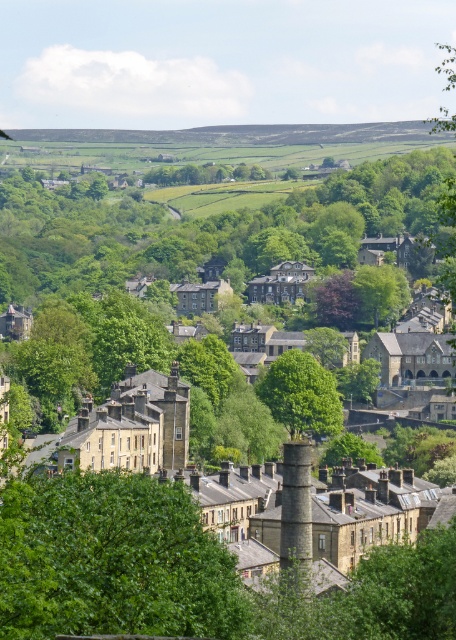
You are a bird flying over the town and want to land on the stone chimney at center. However, there is a green leafy tree at center in the way. Can you land on the chimney without flying through the tree?

The green leafy tree at center is positioned over the stone chimney at center, so the tree is blocking the chimney. Therefore, you cannot land on the stone chimney at center without flying through the tree.

You are standing in the town square and want to take a photo of both the green leafy tree at center and the stone chimney at center. Which object should you position to the left side of your camera frame to include both in the shot?

You should position the stone chimney at center to the left side of your camera frame because the green leafy tree at center is to the right of the stone chimney at center.